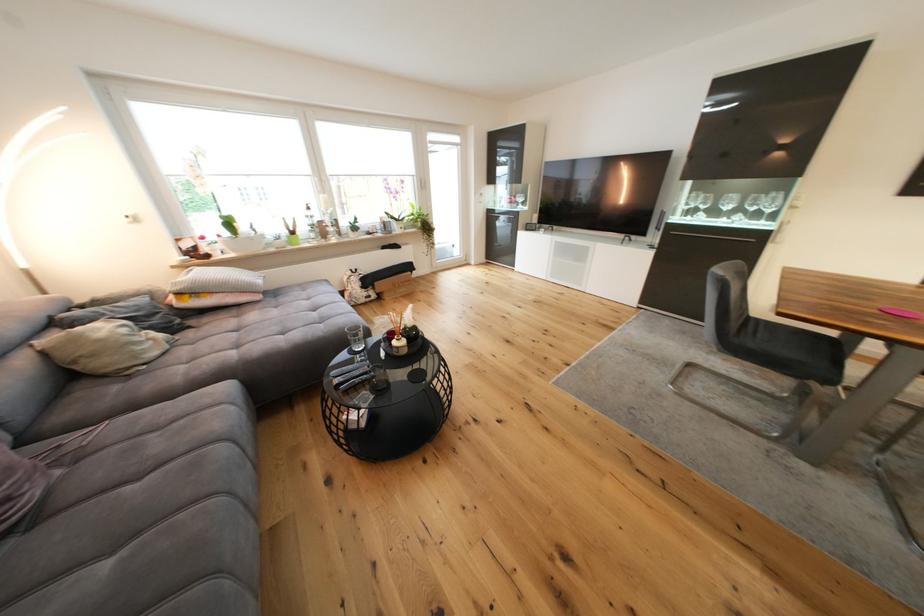
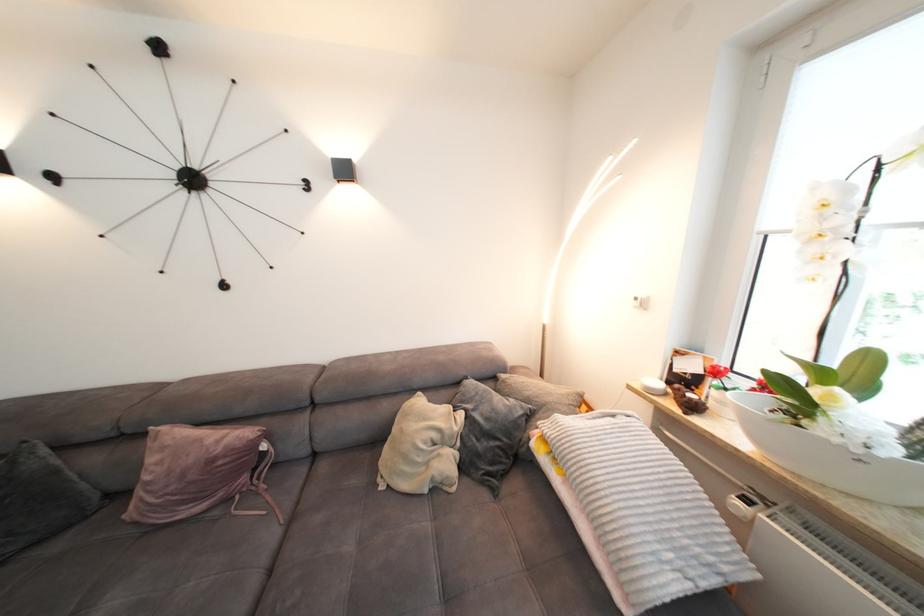
Locate, in the second image, the point that corresponds to point (191, 262) in the first image.

(657, 391)